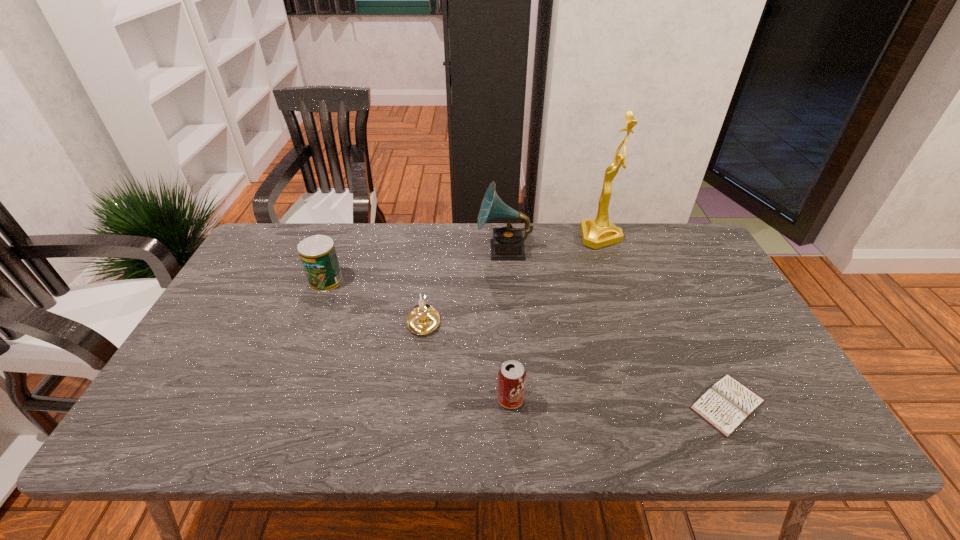
This screenshot has width=960, height=540. In order to click on vacant region at the near right corner of the desktop in this screenshot , I will do `click(796, 443)`.

Image resolution: width=960 pixels, height=540 pixels. In order to click on free spot between the candle holder and the second tallest object in this screenshot , I will do `click(464, 285)`.

Locate an element on the screen. This screenshot has height=540, width=960. free area in between the can and the diary is located at coordinates (527, 342).

Find the location of a particular element. empty space that is in between the second tallest object and the tallest object is located at coordinates (552, 244).

I want to click on free space between the award and the diary, so click(x=664, y=320).

Identify the location of vacant space in between the fourth nearest object and the second tallest object. (415, 266).

Image resolution: width=960 pixels, height=540 pixels. I want to click on free space between the fourth farthest object and the diary, so click(576, 362).

Locate an element on the screen. vacant space that is in between the fourth shortest object and the soda can is located at coordinates (419, 340).

Identify the location of free spot between the fifth object from right to left and the soda can. (468, 360).

This screenshot has height=540, width=960. What are the coordinates of `free space between the fifth object from right to left and the soda can` in the screenshot? It's located at (468, 360).